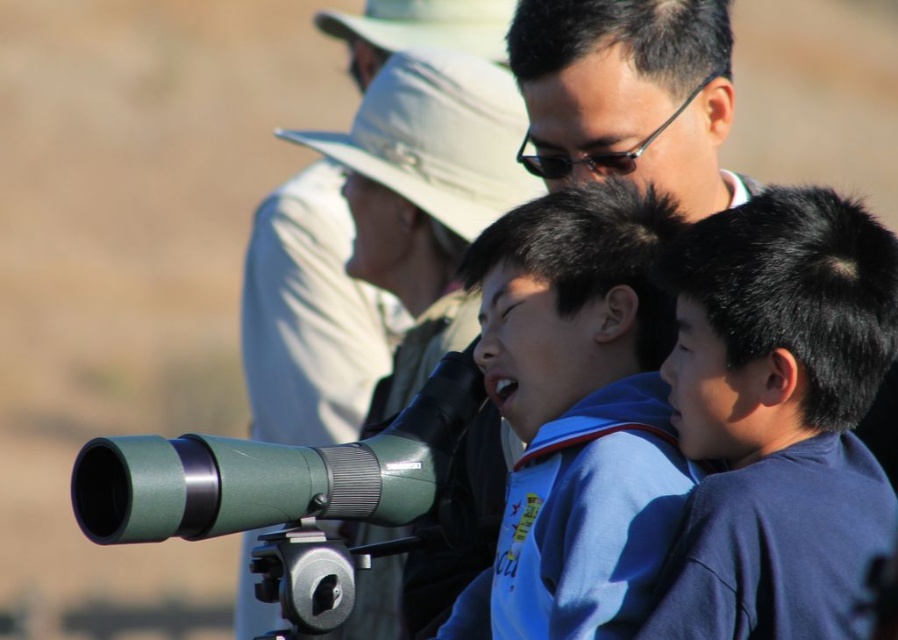
Question: Is dark blue shirt at center thinner than blue fabric shirt at center?

Choices:
 (A) no
 (B) yes

Answer: (B)

Question: Which point is closer to the camera?

Choices:
 (A) dark blue shirt at center
 (B) green rubber binoculars at center

Answer: (A)

Question: Which is nearer to the blue fabric shirt at center?

Choices:
 (A) matte black binoculars at center
 (B) dark blue shirt at center

Answer: (B)

Question: Which of the following is the farthest from the observer?

Choices:
 (A) [x=685, y=176]
 (B) [x=756, y=230]
 (C) [x=333, y=413]

Answer: (C)

Question: Can you confirm if dark blue shirt at center is wider than green plastic telescope at center?

Choices:
 (A) yes
 (B) no

Answer: (B)

Question: Does matte black binoculars at center appear over green plastic telescope at center?

Choices:
 (A) yes
 (B) no

Answer: (B)